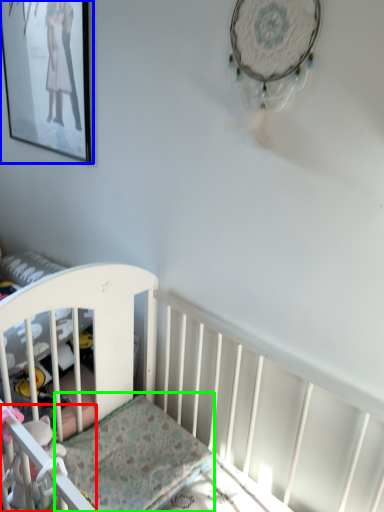
Question: Considering the real-world distances, which object is farthest from toy (highlighted by a red box)? picture frame (highlighted by a blue box) or mattress (highlighted by a green box)?

Choices:
 (A) picture frame
 (B) mattress

Answer: (A)